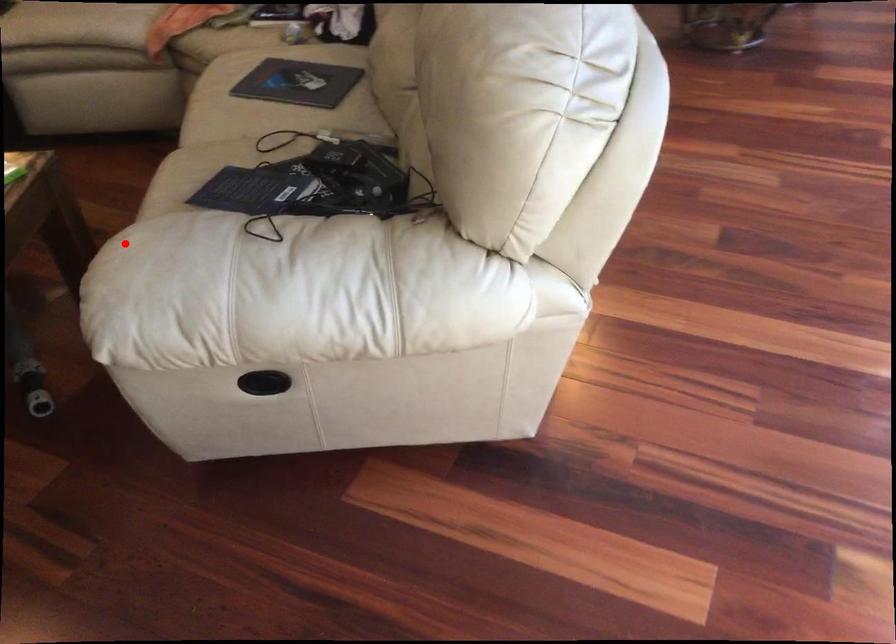
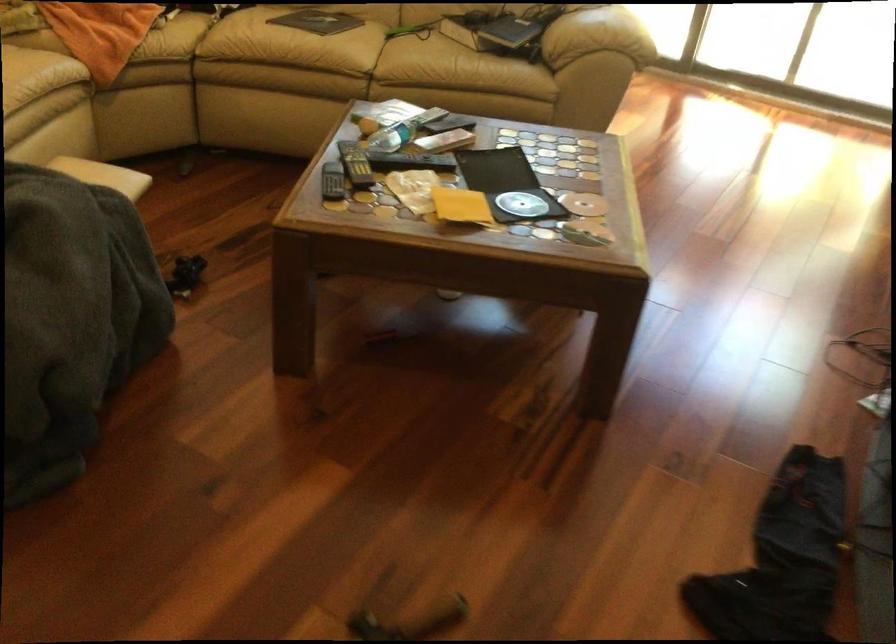
Find the pixel in the second image that matches the highlighted location in the first image.

(597, 35)